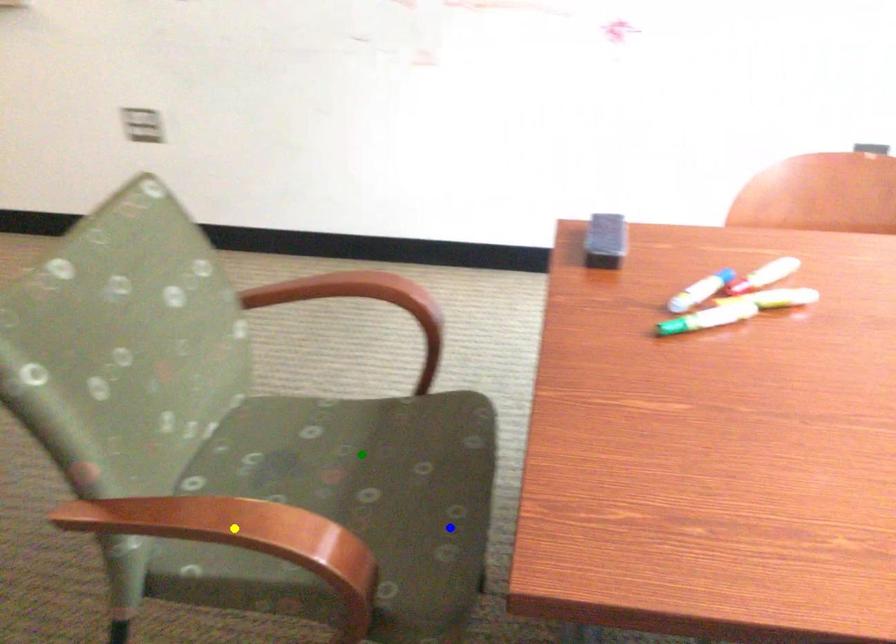
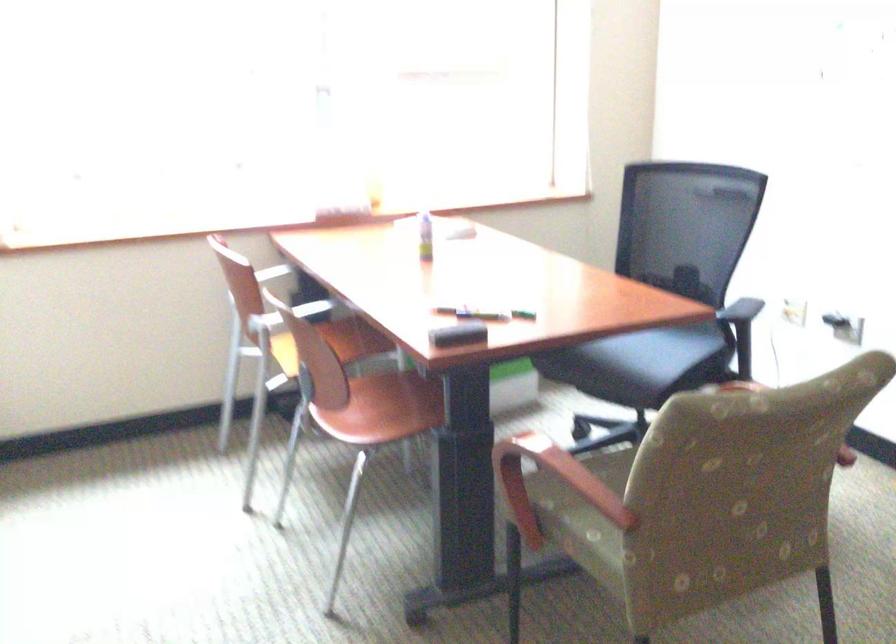
I am providing you with two images of the same scene from different viewpoints. Three points are marked in image1. Which point corresponds to a part or object that is occluded in image2?In image1, three points are marked. Which of them correspond to a part or object that is occluded in image2?Among the three points shown in image1, which one corresponds to a part or object that is no longer visible due to occlusion in image2?

green point, yellow point